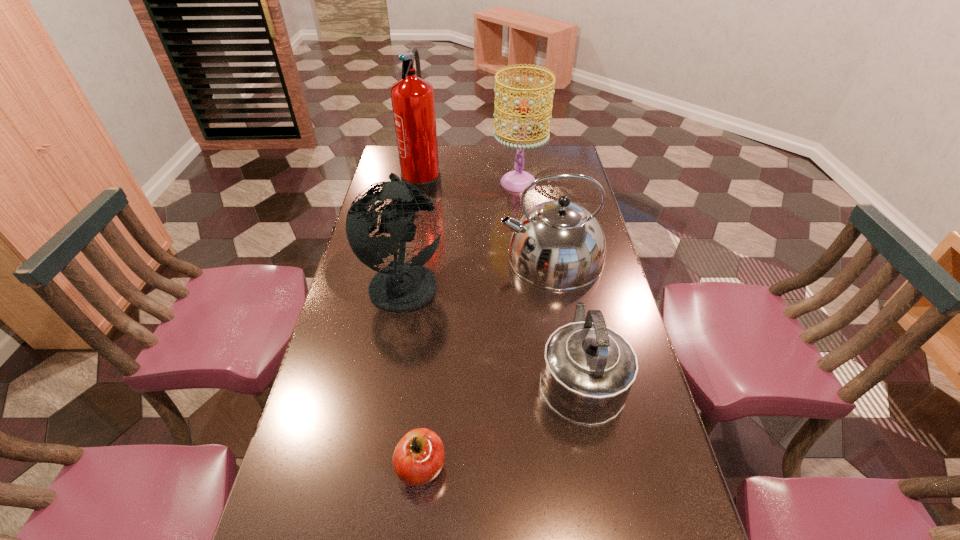
What are the coordinates of `free space located 0.080m on the front-facing side of the globe` in the screenshot? It's located at (471, 281).

Find the location of a particular element. This screenshot has width=960, height=540. vacant space located from the spout of the taller kettle is located at coordinates (453, 257).

Find the location of a particular element. The width and height of the screenshot is (960, 540). vacant space located from the spout of the taller kettle is located at coordinates (474, 257).

Image resolution: width=960 pixels, height=540 pixels. In order to click on vacant space situated from the spout of the taller kettle in this screenshot , I will do `click(453, 257)`.

The height and width of the screenshot is (540, 960). Find the location of `vacant position located 0.300m with the spout at the front of the fifth tallest object`. vacant position located 0.300m with the spout at the front of the fifth tallest object is located at coordinates (559, 260).

Locate an element on the screen. vacant space located 0.060m with the spout at the front of the fifth tallest object is located at coordinates (569, 315).

You are a GUI agent. You are given a task and a screenshot of the screen. Output one action in this format:
    pyautogui.click(x=<x>, y=<y>)
    Task: Click on the free space located with the spout at the front of the fifth tallest object
    The height and width of the screenshot is (540, 960).
    Given the screenshot: What is the action you would take?
    pyautogui.click(x=568, y=312)

Where is `free location located 0.340m on the right of the shortest object`? The height and width of the screenshot is (540, 960). free location located 0.340m on the right of the shortest object is located at coordinates (601, 467).

Image resolution: width=960 pixels, height=540 pixels. In order to click on fire extinguisher that is at the far edge in this screenshot , I will do (412, 97).

The height and width of the screenshot is (540, 960). I want to click on lampshade positioned at the far edge, so click(x=516, y=181).